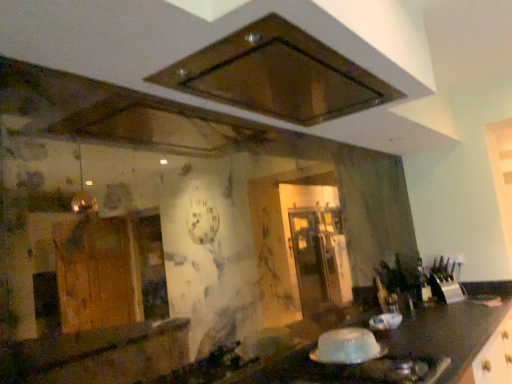
Question: Can you confirm if translucent plastic container at lower center is positioned to the left of brown matte exhaust hood at upper center?

Choices:
 (A) yes
 (B) no

Answer: (B)

Question: Considering the relative positions of translucent plastic container at lower center and brown matte exhaust hood at upper center in the image provided, is translucent plastic container at lower center behind brown matte exhaust hood at upper center?

Choices:
 (A) yes
 (B) no

Answer: (A)

Question: Considering the relative positions of translucent plastic container at lower center and brown matte exhaust hood at upper center in the image provided, is translucent plastic container at lower center to the right of brown matte exhaust hood at upper center from the viewer's perspective?

Choices:
 (A) no
 (B) yes

Answer: (B)

Question: Considering the relative sizes of translucent plastic container at lower center and brown matte exhaust hood at upper center in the image provided, is translucent plastic container at lower center thinner than brown matte exhaust hood at upper center?

Choices:
 (A) yes
 (B) no

Answer: (A)

Question: Is translucent plastic container at lower center beside brown matte exhaust hood at upper center?

Choices:
 (A) no
 (B) yes

Answer: (A)

Question: Considering the positions of point (451, 271) and point (219, 66), is point (451, 271) closer or farther from the camera than point (219, 66)?

Choices:
 (A) closer
 (B) farther

Answer: (B)

Question: From the image's perspective, is metallic silver knife block at right above or below brown matte exhaust hood at upper center?

Choices:
 (A) below
 (B) above

Answer: (A)

Question: Is metallic silver knife block at right taller or shorter than brown matte exhaust hood at upper center?

Choices:
 (A) short
 (B) tall

Answer: (B)

Question: In terms of width, does metallic silver knife block at right look wider or thinner when compared to brown matte exhaust hood at upper center?

Choices:
 (A) wide
 (B) thin

Answer: (B)

Question: Is metallic silver knife block at right in front of or behind white glossy gas stove at lower right in the image?

Choices:
 (A) behind
 (B) front

Answer: (A)

Question: Which is correct: metallic silver knife block at right is inside white glossy gas stove at lower right, or outside of it?

Choices:
 (A) inside
 (B) outside

Answer: (B)

Question: Looking at the image, does metallic silver knife block at right seem bigger or smaller compared to white glossy gas stove at lower right?

Choices:
 (A) small
 (B) big

Answer: (A)

Question: Is point (452, 264) closer or farther from the camera than point (437, 377)?

Choices:
 (A) closer
 (B) farther

Answer: (B)

Question: From their relative heights in the image, would you say white glossy gas stove at lower right is taller or shorter than brown matte exhaust hood at upper center?

Choices:
 (A) short
 (B) tall

Answer: (B)

Question: Visually, is white glossy gas stove at lower right positioned to the left or to the right of brown matte exhaust hood at upper center?

Choices:
 (A) right
 (B) left

Answer: (A)